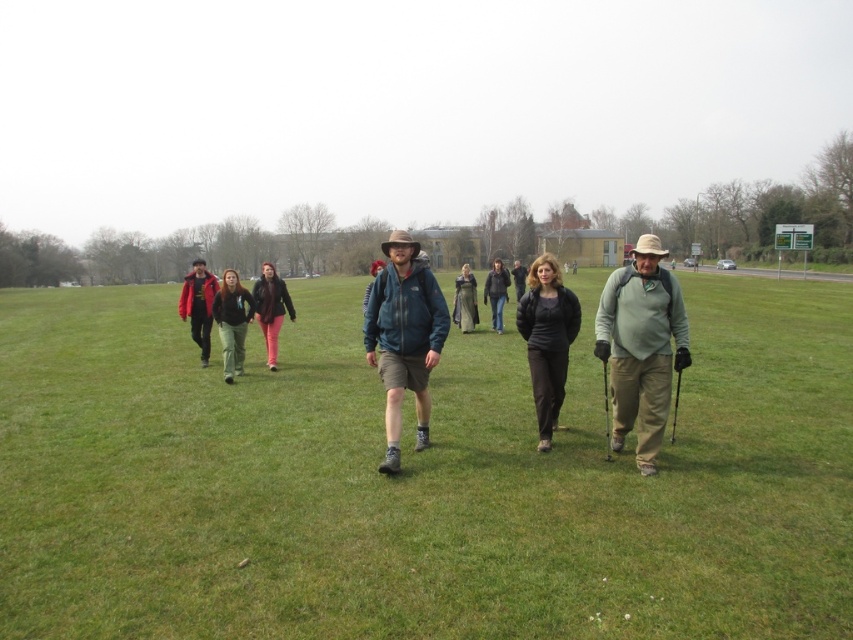
You are a photographer trying to capture the group in the grassy field. You notice the black matte jacket at center and the matte pink pants at center. Based on their positions, which object is located to the east of the other?

The black matte jacket at center is to the right of the matte pink pants at center. Since the image is viewed from the photographer perspective, right corresponds to east, so the black matte jacket at center is east of the matte pink pants at center.

You are a photographer standing at the edge of the grassy field. You want to take a photo of the green fabric jacket at center and the black matte jacket at center. How far apart are these two jackets in the image?

The green fabric jacket at center is 36.52 inches from the black matte jacket at center, so the distance between them is 36.52 inches.